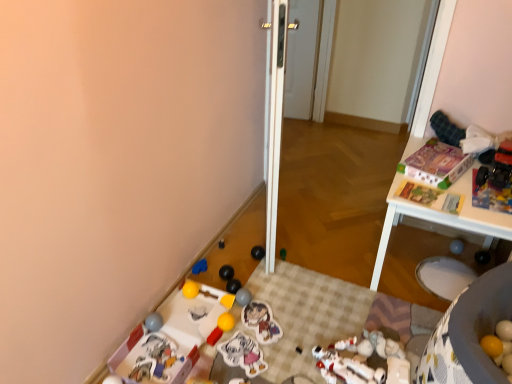
Measure the distance between white plastic toy at lower center, positioned as the sixth toy in left-to-right order, and camera.

white plastic toy at lower center, positioned as the sixth toy in left-to-right order, is 5.64 feet from camera.

Measure the distance between point [196,317] and camera.

A distance of 1.74 meters exists between point [196,317] and camera.

Describe the element at coordinates (275, 124) in the screenshot. I see `white glossy door at center, the first screen door from the left` at that location.

Identify the location of gray rubber ball at lower right, placed as the nineteenth toy when sorted from left to right. This screenshot has height=384, width=512. (456, 246).

Measure the distance between rubber ball at center, arranged as the fourteenth toy when viewed from the left, and camera.

6.83 feet.

The image size is (512, 384). Describe the element at coordinates (283, 254) in the screenshot. I see `rubber ball at center, arranged as the fourteenth toy when viewed from the left` at that location.

Describe the element at coordinates (243, 354) in the screenshot. I see `matte plastic sticker at center, placed as the 11th toy when sorted from left to right` at that location.

In order to face white matte robot at lower center, which is the 5th toy from right to left, should I rotate leftwards or rightwards?

Turn right by 12.380 degrees to look at white matte robot at lower center, which is the 5th toy from right to left.

Image resolution: width=512 pixels, height=384 pixels. Describe the element at coordinates (361, 362) in the screenshot. I see `white matte robot at lower center, which is the 5th toy from right to left` at that location.

Locate an element on the screen. This screenshot has width=512, height=384. white plastic toy at lower center, placed as the 14th toy when sorted from right to left is located at coordinates [198, 312].

Is the depth of yellow rubber ball at lower center, the 9th toy in the left-to-right sequence, less than that of plastic toy at lower left, the 3th toy from the left?

No, yellow rubber ball at lower center, the 9th toy in the left-to-right sequence, is further to the viewer.

Is yellow rubber ball at lower center, the 11th toy in the right-to-left sequence, completely or partially outside of plastic toy at lower left, which is the 17th toy in right-to-left order?

Yes.

From the image's perspective, is yellow rubber ball at lower center, the 9th toy in the left-to-right sequence, located above or below plastic toy at lower left, which is the 17th toy in right-to-left order?

Based on their image positions, yellow rubber ball at lower center, the 9th toy in the left-to-right sequence, is located above plastic toy at lower left, which is the 17th toy in right-to-left order.

Does yellow rubber ball at lower center, the 9th toy in the left-to-right sequence, have a greater width compared to plastic toy at lower left, the 3th toy from the left?

In fact, yellow rubber ball at lower center, the 9th toy in the left-to-right sequence, might be narrower than plastic toy at lower left, the 3th toy from the left.

Is white glossy screen door at center, the 2th screen door in the left-to-right sequence, inside matte plastic sticker at center, placed as the ninth toy when sorted from right to left?

That's incorrect, white glossy screen door at center, the 2th screen door in the left-to-right sequence, is not inside matte plastic sticker at center, placed as the ninth toy when sorted from right to left.

The height and width of the screenshot is (384, 512). In order to click on toy that is the 5th object to the left of the white glossy screen door at center, arranged as the first screen door when viewed from the right, starting at the anchor in this screenshot , I will do `click(243, 354)`.

In the image, is matte plastic sticker at center, placed as the 11th toy when sorted from left to right, positioned in front of or behind white glossy screen door at center, arranged as the first screen door when viewed from the right?

Clearly, matte plastic sticker at center, placed as the 11th toy when sorted from left to right, is in front of white glossy screen door at center, arranged as the first screen door when viewed from the right.

Is matte plastic sticker at center, placed as the 11th toy when sorted from left to right, thinner than white glossy screen door at center, which appears as the second screen door when viewed from the front?

In fact, matte plastic sticker at center, placed as the 11th toy when sorted from left to right, might be wider than white glossy screen door at center, which appears as the second screen door when viewed from the front.

Consider the image. Who is bigger, yellow matte ball at lower right, the 17th toy positioned from the left, or black rubber ball at lower center, which appears as the 13th toy when viewed from the right?

black rubber ball at lower center, which appears as the 13th toy when viewed from the right, is bigger.

In the image, is yellow matte ball at lower right, the third toy positioned from the right, positioned in front of or behind black rubber ball at lower center, which appears as the 13th toy when viewed from the right?

Clearly, yellow matte ball at lower right, the third toy positioned from the right, is in front of black rubber ball at lower center, which appears as the 13th toy when viewed from the right.

Which is more to the right, yellow matte ball at lower right, the 17th toy positioned from the left, or black rubber ball at lower center, placed as the seventh toy when sorted from left to right?

yellow matte ball at lower right, the 17th toy positioned from the left.

From the image's perspective, is yellow matte ball at lower right, the 17th toy positioned from the left, over black rubber ball at lower center, placed as the seventh toy when sorted from left to right?

Actually, yellow matte ball at lower right, the 17th toy positioned from the left, appears below black rubber ball at lower center, placed as the seventh toy when sorted from left to right, in the image.

In the scene shown: Between white matte robot at lower center, which is the 5th toy from right to left, and matte plastic sticker at center, marked as the seventh toy in a right-to-left arrangement, which one appears on the right side from the viewer's perspective?

white matte robot at lower center, which is the 5th toy from right to left, is more to the right.

Which object is wider, white matte robot at lower center, the 15th toy viewed from the left, or matte plastic sticker at center, marked as the seventh toy in a right-to-left arrangement?

white matte robot at lower center, the 15th toy viewed from the left, is wider.

Are white matte robot at lower center, the 15th toy viewed from the left, and matte plastic sticker at center, marked as the seventh toy in a right-to-left arrangement, located far from each other?

white matte robot at lower center, the 15th toy viewed from the left, is actually quite close to matte plastic sticker at center, marked as the seventh toy in a right-to-left arrangement.

How much distance is there between white matte robot at lower center, the 15th toy viewed from the left, and matte plastic sticker at center, arranged as the thirteenth toy when viewed from the left?

A distance of 11.75 inches exists between white matte robot at lower center, the 15th toy viewed from the left, and matte plastic sticker at center, arranged as the thirteenth toy when viewed from the left.

Could yellow rubber ball at lower center, the 9th toy in the left-to-right sequence, be considered to be inside matte cardboard box at upper right, the sixteenth toy when ordered from left to right?

That's incorrect, yellow rubber ball at lower center, the 9th toy in the left-to-right sequence, is not inside matte cardboard box at upper right, the sixteenth toy when ordered from left to right.

Can you confirm if matte cardboard box at upper right, marked as the 4th toy in a right-to-left arrangement, is bigger than yellow rubber ball at lower center, the 9th toy in the left-to-right sequence?

Yes, matte cardboard box at upper right, marked as the 4th toy in a right-to-left arrangement, is bigger than yellow rubber ball at lower center, the 9th toy in the left-to-right sequence.

Find the location of a particular element. This screenshot has height=384, width=512. the 5th toy positioned above the yellow rubber ball at lower center, the 11th toy in the right-to-left sequence (from a real-world perspective) is located at coordinates (436, 164).

Consider the image. Is matte cardboard box at upper right, marked as the 4th toy in a right-to-left arrangement, touching yellow rubber ball at lower center, the 9th toy in the left-to-right sequence?

No, matte cardboard box at upper right, marked as the 4th toy in a right-to-left arrangement, is not beside yellow rubber ball at lower center, the 9th toy in the left-to-right sequence.

How many degrees apart are the facing directions of matte plastic sticker at center, placed as the 11th toy when sorted from left to right, and yellow rubber ball at lower center, the 11th toy in the right-to-left sequence?

The angular difference between matte plastic sticker at center, placed as the 11th toy when sorted from left to right, and yellow rubber ball at lower center, the 11th toy in the right-to-left sequence, is 146 degrees.

Which of these two, matte plastic sticker at center, placed as the 11th toy when sorted from left to right, or yellow rubber ball at lower center, the 11th toy in the right-to-left sequence, is bigger?

Bigger between the two is matte plastic sticker at center, placed as the 11th toy when sorted from left to right.

Considering the relative positions of matte plastic sticker at center, placed as the ninth toy when sorted from right to left, and yellow rubber ball at lower center, the 9th toy in the left-to-right sequence, in the image provided, is matte plastic sticker at center, placed as the ninth toy when sorted from right to left, to the left of yellow rubber ball at lower center, the 9th toy in the left-to-right sequence, from the viewer's perspective?

No, matte plastic sticker at center, placed as the ninth toy when sorted from right to left, is not to the left of yellow rubber ball at lower center, the 9th toy in the left-to-right sequence.

Consider the image. From the image's perspective, who appears lower, white plastic table at upper right or rubber ball at center, arranged as the fourteenth toy when viewed from the left?

rubber ball at center, arranged as the fourteenth toy when viewed from the left, is shown below in the image.

From a real-world perspective, who is located higher, white plastic table at upper right or rubber ball at center, positioned as the 6th toy in right-to-left order?

white plastic table at upper right.

Considering the relative sizes of white plastic table at upper right and rubber ball at center, arranged as the fourteenth toy when viewed from the left, in the image provided, is white plastic table at upper right thinner than rubber ball at center, arranged as the fourteenth toy when viewed from the left,?

In fact, white plastic table at upper right might be wider than rubber ball at center, arranged as the fourteenth toy when viewed from the left.

Identify the location of table on the right of the rubber ball at center, arranged as the fourteenth toy when viewed from the left. (441, 218).

From the image's perspective, starting from the plastic toy at lower left, which is the 17th toy in right-to-left order, which toy is the 3rd one above? Please provide its 2D coordinates.

[(226, 322)]

You are a GUI agent. You are given a task and a screenshot of the screen. Output one action in this format:
    pyautogui.click(x=<x>, y=<y>)
    Task: Click on the 15th toy in front when counting from the white glossy screen door at center, arranged as the first screen door when viewed from the right
    The width and height of the screenshot is (512, 384).
    Given the screenshot: What is the action you would take?
    pyautogui.click(x=243, y=354)

Which object lies further to the anchor point gray rubber ball at lower right, placed as the nineteenth toy when sorted from left to right, matte plastic sticker at center, arranged as the thirteenth toy when viewed from the left, or plastic toy car at lower left, the 2th toy positioned from the left?

Based on the image, plastic toy car at lower left, the 2th toy positioned from the left, appears to be further to gray rubber ball at lower right, placed as the nineteenth toy when sorted from left to right.

When comparing their distances from matte gray ball at center, which ranks as the 10th toy in right-to-left order, does plastic toy car at upper right, the 18th toy when ordered from left to right, or rubber ball at center, arranged as the fourteenth toy when viewed from the left, seem closer?

rubber ball at center, arranged as the fourteenth toy when viewed from the left, lies closer to matte gray ball at center, which ranks as the 10th toy in right-to-left order, than the other object.

Estimate the real-world distances between objects in this image. Which object is closer to blue fabric toy at lower left, placed as the fifth toy when sorted from left to right, matte gray ball at center, which ranks as the 10th toy in right-to-left order, or yellow matte ball at lower right, the 17th toy positioned from the left?

Based on the image, matte gray ball at center, which ranks as the 10th toy in right-to-left order, appears to be nearer to blue fabric toy at lower left, placed as the fifth toy when sorted from left to right.

From the image, which object appears to be nearer to plastic toy at lower left, the 3th toy from the left, yellow rubber ball at lower center, the 9th toy in the left-to-right sequence, or white matte robot at lower center, which is the 5th toy from right to left?

yellow rubber ball at lower center, the 9th toy in the left-to-right sequence, is positioned closer to the anchor plastic toy at lower left, the 3th toy from the left.

Looking at the image, which one is located closer to white glossy screen door at center, the 2th screen door in the left-to-right sequence, white matte robot at lower center, which is the 5th toy from right to left, or rubber ball at center, positioned as the 6th toy in right-to-left order?

rubber ball at center, positioned as the 6th toy in right-to-left order.

Which object lies nearer to the anchor point white plastic table at upper right, matte plastic sticker at center, placed as the 11th toy when sorted from left to right, or gray rubber ball at lower right, placed as the nineteenth toy when sorted from left to right?

gray rubber ball at lower right, placed as the nineteenth toy when sorted from left to right, lies closer to white plastic table at upper right than the other object.

Considering their positions, is matte plastic sticker at center, marked as the seventh toy in a right-to-left arrangement, positioned closer to rubber ball at center, arranged as the fourteenth toy when viewed from the left, than matte cardboard box at upper right, marked as the 4th toy in a right-to-left arrangement?

matte plastic sticker at center, marked as the seventh toy in a right-to-left arrangement, is positioned closer to the anchor rubber ball at center, arranged as the fourteenth toy when viewed from the left.

Based on their spatial positions, is yellow matte toy at lower center, which is counted as the eighth toy, starting from the left, or yellow rubber ball at lower left, which is the fourth toy from left to right, further from white matte robot at lower center, the 15th toy viewed from the left?

Based on the image, yellow rubber ball at lower left, which is the fourth toy from left to right, appears to be further to white matte robot at lower center, the 15th toy viewed from the left.

I want to click on table situated between yellow rubber ball at lower left, which is the fourth toy from left to right, and plastic toy car at upper right, the 18th toy when ordered from left to right, from left to right, so click(441, 218).

Where is `table between plastic toy at lower left, the 3th toy from the left, and white glossy screen door at center, which appears as the second screen door when viewed from the front, from front to back`? This screenshot has width=512, height=384. table between plastic toy at lower left, the 3th toy from the left, and white glossy screen door at center, which appears as the second screen door when viewed from the front, from front to back is located at coordinates (441, 218).

This screenshot has width=512, height=384. What are the coordinates of `table between matte cardboard box at upper right, marked as the 4th toy in a right-to-left arrangement, and white matte robot at lower center, the 15th toy viewed from the left, vertically` in the screenshot? It's located at (441, 218).

Identify the location of table situated between blue fabric toy at lower left, the fifteenth toy in the right-to-left sequence, and gray rubber ball at lower right, placed as the nineteenth toy when sorted from left to right, from left to right. (441, 218).